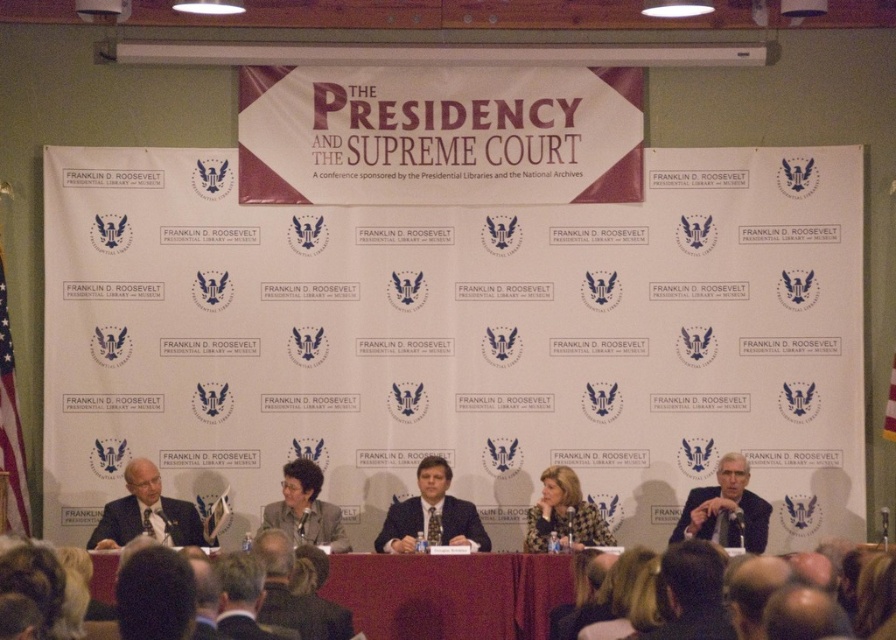
Question: Which object is farther from the camera taking this photo?

Choices:
 (A) matte black suit at left
 (B) patterned fabric jacket at center
 (C) matte black suit at center

Answer: (A)

Question: Which point is farther from the camera taking this photo?

Choices:
 (A) (711, 488)
 (B) (296, 536)
 (C) (418, 483)
 (D) (588, 506)

Answer: (A)

Question: Is patterned fabric jacket at center bigger than gray fabric jacket at center?

Choices:
 (A) no
 (B) yes

Answer: (A)

Question: Based on their relative distances, which object is nearer to the patterned fabric jacket at center?

Choices:
 (A) matte black suit at left
 (B) matte black suit at right

Answer: (B)

Question: Can you confirm if matte black suit at left is wider than matte black suit at right?

Choices:
 (A) yes
 (B) no

Answer: (A)

Question: Does matte black suit at left have a smaller size compared to gray fabric jacket at center?

Choices:
 (A) yes
 (B) no

Answer: (A)